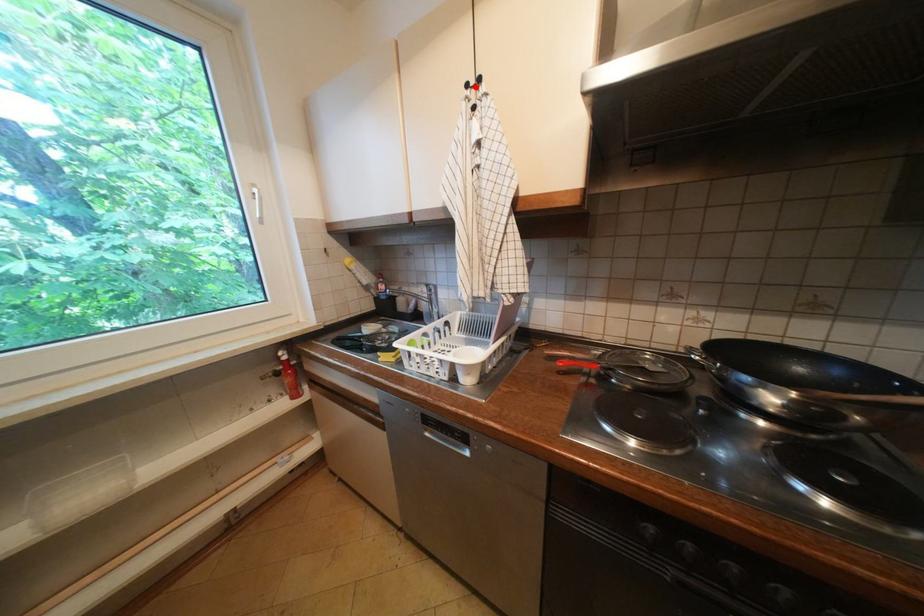
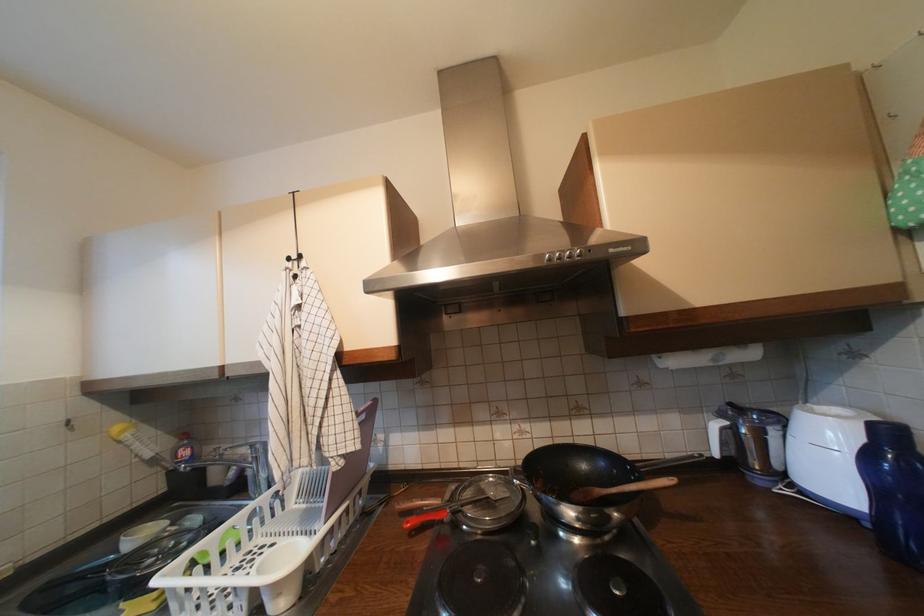
Where in the second image is the point corresponding to the highlighted location from the first image?

(297, 260)